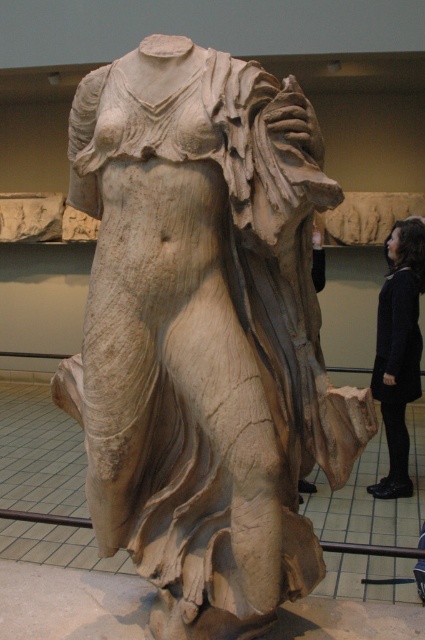
Question: In this image, where is white marble statue at center located relative to dark woolen sweater at center?

Choices:
 (A) below
 (B) above

Answer: (B)

Question: Which object is farther from the camera taking this photo?

Choices:
 (A) dark woolen sweater at center
 (B) white marble statue at center

Answer: (A)

Question: Does white marble statue at center have a lesser width compared to dark woolen sweater at center?

Choices:
 (A) yes
 (B) no

Answer: (B)

Question: Does white marble statue at center lie behind dark woolen sweater at center?

Choices:
 (A) no
 (B) yes

Answer: (A)

Question: Which of the following is the closest to the observer?

Choices:
 (A) dark woolen sweater at center
 (B) white marble statue at center

Answer: (B)